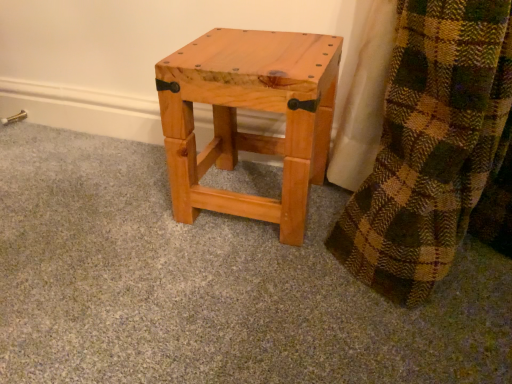
The height and width of the screenshot is (384, 512). Identify the location of vacant space underneath natural wood stool at center (from a real-world perspective). (248, 177).